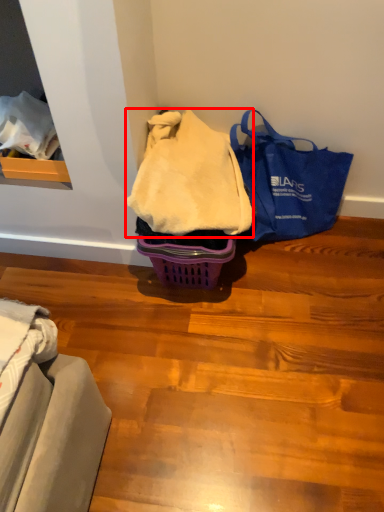
Question: Where is blanket (annotated by the red box) located in relation to handbag in the image?

Choices:
 (A) right
 (B) left

Answer: (B)